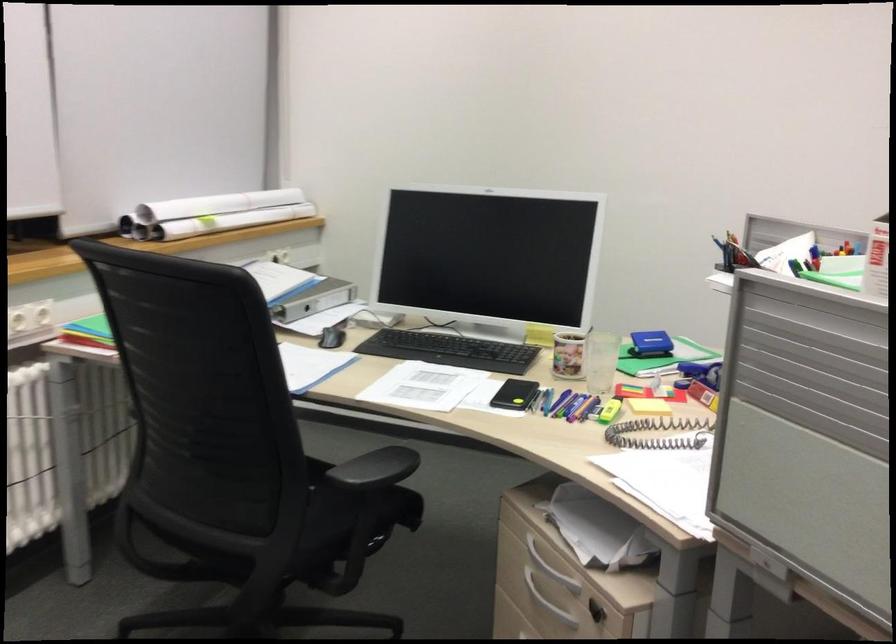
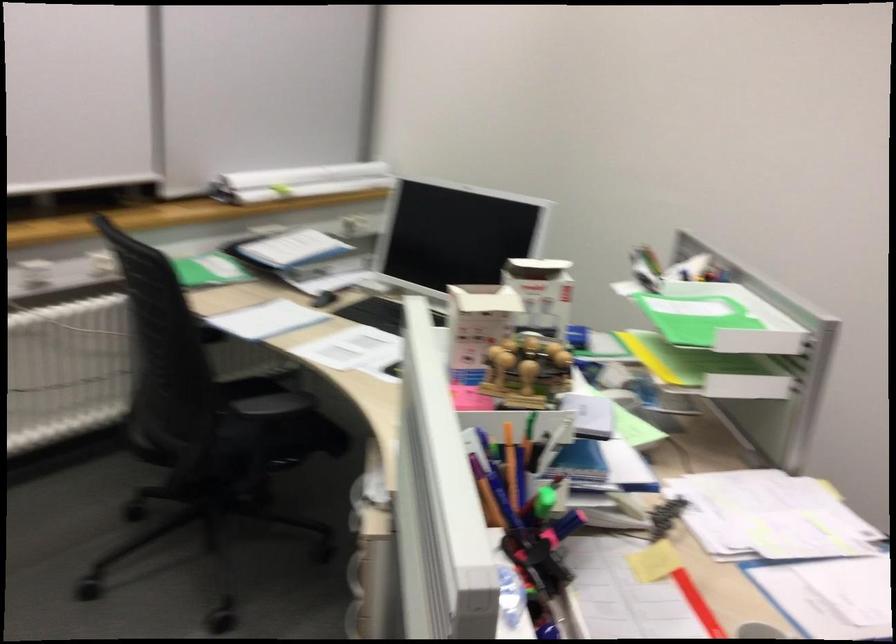
Question: The images are taken continuously from a first-person perspective. In which direction is your viewpoint rotating?

Choices:
 (A) Left
 (B) Right
 (C) Up
 (D) Down

Answer: (A)